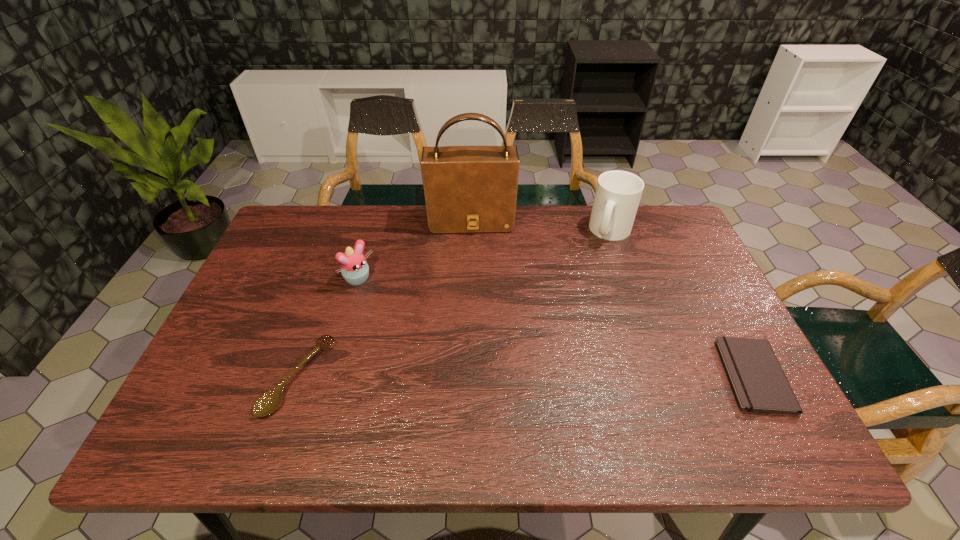
Locate an element on the screen. The width and height of the screenshot is (960, 540). vacant space on the desktop that is between the fourth tallest object and the rightmost object and is positioned on the handle side of the second tallest object is located at coordinates (579, 376).

This screenshot has width=960, height=540. I want to click on free space on the desktop that is between the second shortest object and the rightmost object and is positioned on the face of the third nearest object, so click(x=480, y=376).

Identify the location of free space on the desktop that is between the fourth tallest object and the checkbook and is positioned on the front flap of the third object from right to left. (475, 376).